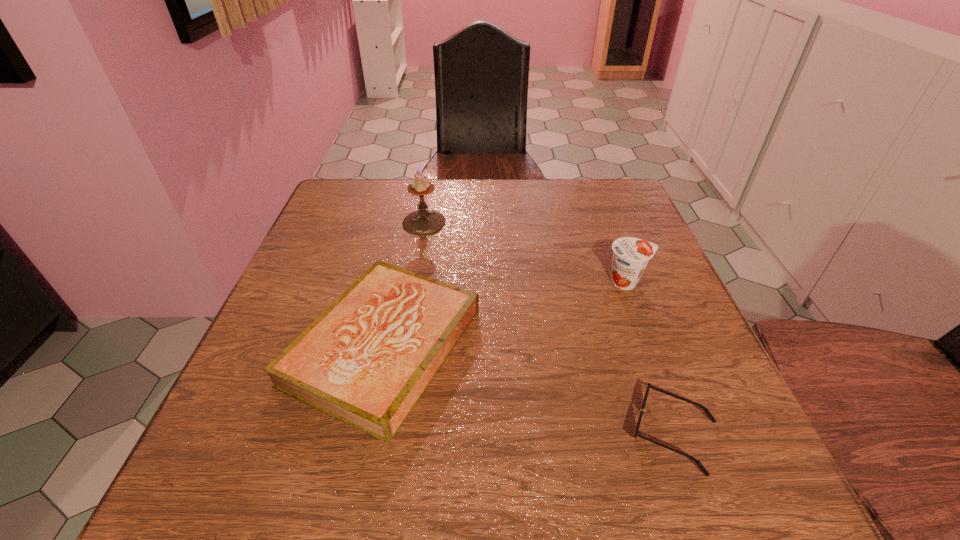
Image resolution: width=960 pixels, height=540 pixels. I want to click on the tallest object, so pyautogui.click(x=422, y=222).

Identify the location of candle holder. This screenshot has width=960, height=540. (422, 222).

You are a GUI agent. You are given a task and a screenshot of the screen. Output one action in this format:
    pyautogui.click(x=<x>, y=<y>)
    Task: Click on the third shortest object
    
    Given the screenshot: What is the action you would take?
    pyautogui.click(x=630, y=255)

Locate an element on the screen. This screenshot has height=540, width=960. hardback book is located at coordinates [366, 360].

Where is `sunglasses`? This screenshot has height=540, width=960. sunglasses is located at coordinates (649, 386).

Identify the location of blank area located on the right of the candle holder. This screenshot has height=540, width=960. (522, 222).

Identify the location of vacant space situated on the left of the yogurt. The image size is (960, 540). (494, 282).

Where is `vacant region located on the right of the hardback book`? The height and width of the screenshot is (540, 960). vacant region located on the right of the hardback book is located at coordinates (646, 346).

You are a GUI agent. You are given a task and a screenshot of the screen. Output one action in this format:
    pyautogui.click(x=<x>, y=<y>)
    Task: Click on the vacant space located 0.210m on the lenses of the sunglasses
    This screenshot has height=540, width=960.
    Given the screenshot: What is the action you would take?
    pyautogui.click(x=486, y=433)

The image size is (960, 540). Find the location of `vacant space located on the lenses of the sunglasses`. vacant space located on the lenses of the sunglasses is located at coordinates (433, 433).